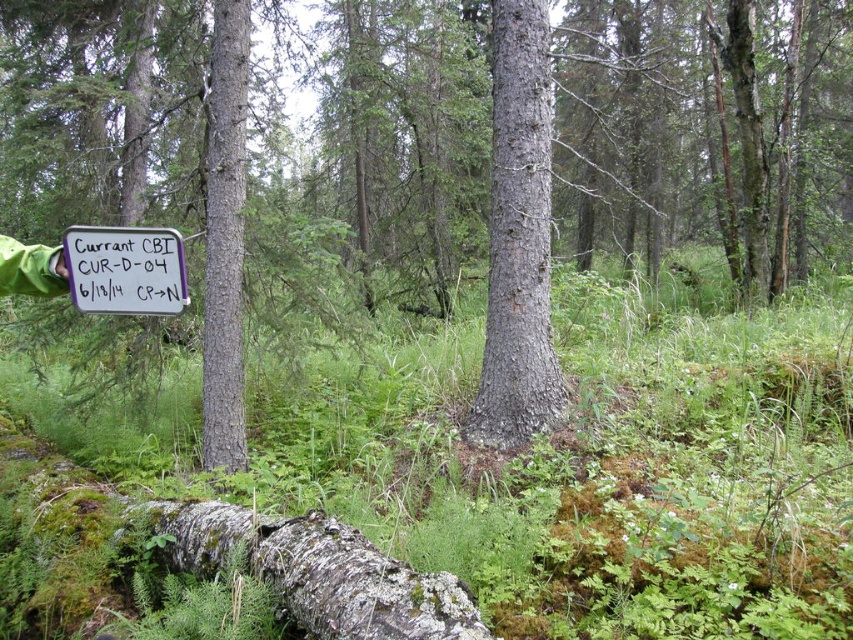
Which is below, smooth gray tree trunk at center or white paper sign at center?

white paper sign at center is lower down.

Consider the image. Is smooth gray tree trunk at center shorter than white paper sign at center?

No, smooth gray tree trunk at center is not shorter than white paper sign at center.

What do you see at coordinates (224, 236) in the screenshot?
I see `smooth gray tree trunk at center` at bounding box center [224, 236].

Image resolution: width=853 pixels, height=640 pixels. What are the coordinates of `smooth gray tree trunk at center` in the screenshot? It's located at (224, 236).

Does smooth bark tree at center appear on the right side of smooth gray tree trunk at center?

Correct, you'll find smooth bark tree at center to the right of smooth gray tree trunk at center.

Between smooth bark tree at center and smooth gray tree trunk at center, which one has less height?

Standing shorter between the two is smooth gray tree trunk at center.

Where is `smooth bark tree at center`? smooth bark tree at center is located at coordinates (705, 131).

Can you confirm if smooth gray bark at center is wider than smooth gray tree trunk at center?

No.

Does smooth gray bark at center have a greater height compared to smooth gray tree trunk at center?

Incorrect, smooth gray bark at center's height is not larger of smooth gray tree trunk at center's.

Between point (527, 88) and point (219, 236), which one is positioned in front?

Point (527, 88) is more forward.

Find the location of a particular element. The height and width of the screenshot is (640, 853). smooth gray bark at center is located at coordinates (518, 237).